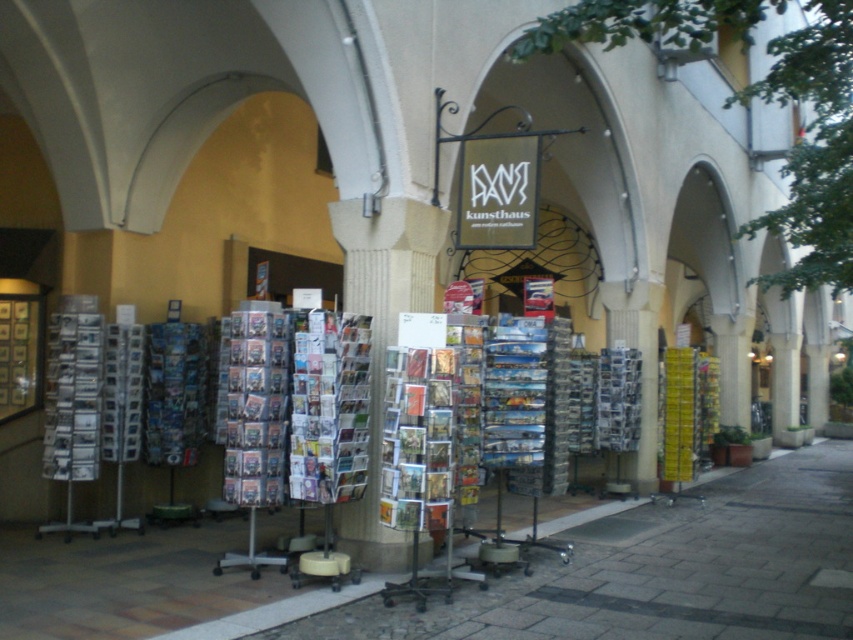
Is point (193, 588) positioned before point (328, 422)?

That is False.

Which is in front, point (590, 532) or point (335, 339)?

Point (335, 339)

Between point (366, 611) and point (310, 387), which one is positioned behind?

Point (310, 387)

Image resolution: width=853 pixels, height=640 pixels. I want to click on smooth stone pavement at center, so click(490, 579).